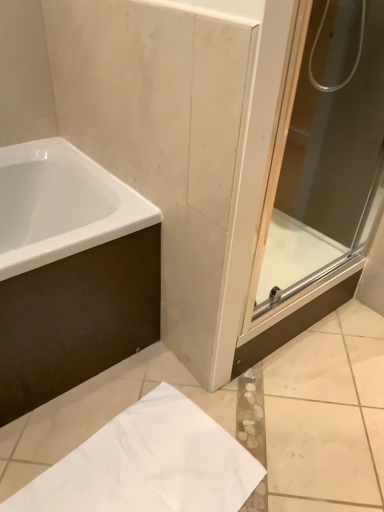
Question: Is white matte paper at lower center not within white glossy bathtub at upper left?

Choices:
 (A) yes
 (B) no

Answer: (A)

Question: Does white matte paper at lower center have a greater width compared to white glossy bathtub at upper left?

Choices:
 (A) yes
 (B) no

Answer: (B)

Question: From a real-world perspective, is white matte paper at lower center below white glossy bathtub at upper left?

Choices:
 (A) yes
 (B) no

Answer: (A)

Question: Does white matte paper at lower center have a larger size compared to white glossy bathtub at upper left?

Choices:
 (A) yes
 (B) no

Answer: (B)

Question: Does white matte paper at lower center appear on the right side of white glossy bathtub at upper left?

Choices:
 (A) no
 (B) yes

Answer: (B)

Question: Is white matte paper at lower center far from white glossy bathtub at upper left?

Choices:
 (A) no
 (B) yes

Answer: (A)

Question: Is transparent glass shower door at right a part of white matte paper at lower center?

Choices:
 (A) yes
 (B) no

Answer: (B)

Question: Does white matte paper at lower center have a greater height compared to transparent glass shower door at right?

Choices:
 (A) yes
 (B) no

Answer: (B)

Question: Could you tell me if white matte paper at lower center is facing transparent glass shower door at right?

Choices:
 (A) yes
 (B) no

Answer: (B)

Question: Does white matte paper at lower center have a lesser height compared to transparent glass shower door at right?

Choices:
 (A) no
 (B) yes

Answer: (B)

Question: From the image's perspective, is white matte paper at lower center located beneath transparent glass shower door at right?

Choices:
 (A) no
 (B) yes

Answer: (B)

Question: From a real-world perspective, is white matte paper at lower center located higher than transparent glass shower door at right?

Choices:
 (A) yes
 (B) no

Answer: (B)

Question: Does transparent glass shower door at right have a lesser width compared to white matte paper at lower center?

Choices:
 (A) yes
 (B) no

Answer: (A)